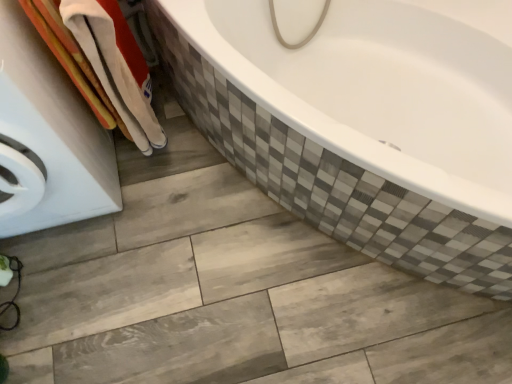
Image resolution: width=512 pixels, height=384 pixels. What are the coordinates of `free location to the right of white cotton towel at left` in the screenshot? It's located at (195, 150).